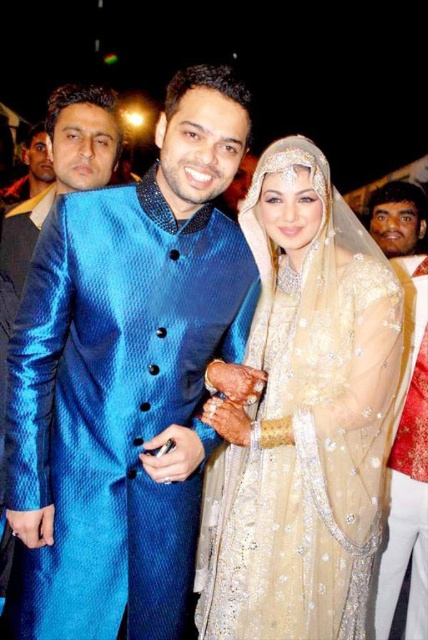
Question: Is ivory satin dress at center behind blue silk sherwani at left?

Choices:
 (A) no
 (B) yes

Answer: (B)

Question: Among these objects, which one is nearest to the camera?

Choices:
 (A) blue silk sherwani at left
 (B) shiny blue sherwani at center
 (C) red satin vest at right

Answer: (B)

Question: Which of the following is the farthest from the observer?

Choices:
 (A) blue silk sherwani at left
 (B) ivory satin dress at center
 (C) matte black shirt at upper left

Answer: (C)

Question: Can you confirm if red satin vest at right is wider than blue silk sherwani at left?

Choices:
 (A) yes
 (B) no

Answer: (B)

Question: Does ivory satin dress at center have a greater width compared to red satin vest at right?

Choices:
 (A) yes
 (B) no

Answer: (A)

Question: Among these points, which one is nearest to the camera?

Choices:
 (A) (407, 252)
 (B) (36, 253)
 (C) (2, 582)

Answer: (B)